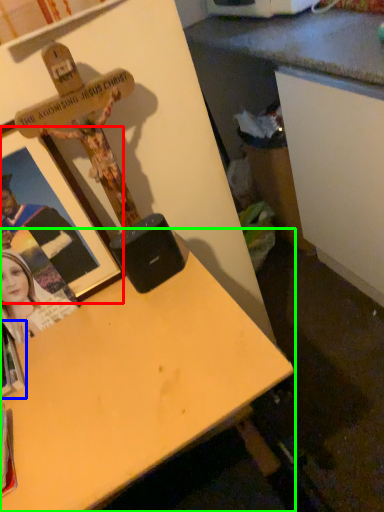
Question: Which is farther away from picture frame (highlighted by a red box)? book (highlighted by a blue box) or desk (highlighted by a green box)?

Choices:
 (A) book
 (B) desk

Answer: (A)